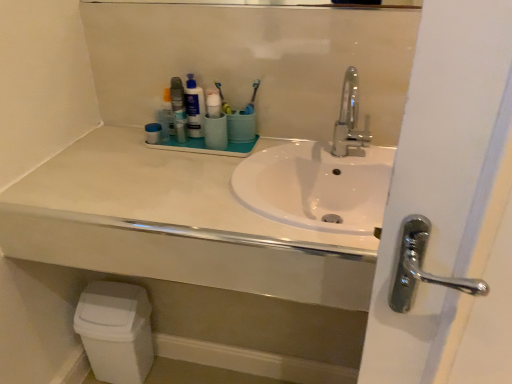
Question: From a real-world perspective, is white matte countertop at center physically located above or below white plastic toothbrush at center, placed as the 2th toothbrush when sorted from right to left?

Choices:
 (A) below
 (B) above

Answer: (A)

Question: Is white matte countertop at center inside or outside of white plastic toothbrush at center, placed as the 2th toothbrush when sorted from right to left?

Choices:
 (A) inside
 (B) outside

Answer: (B)

Question: Which of these objects is positioned farthest from the white glossy toothpaste tube at center, which is the 2th toiletry in left-to-right order?

Choices:
 (A) blue glossy lotion at center
 (B) polished chrome faucet at center
 (C) white matte countertop at center
 (D) blue plastic toothbrush at center, the 2th toothbrush viewed from the left
 (E) matte blue cup at center, which is the 1th toiletry from right to left

Answer: (C)

Question: Estimate the real-world distances between objects in this image. Which object is closer to the blue glossy lotion at center?

Choices:
 (A) white plastic toothbrush at center, placed as the 2th toothbrush when sorted from right to left
 (B) blue plastic toothbrush at center, the 2th toothbrush viewed from the left
 (C) white glossy toothpaste tube at center, the 2th toiletry positioned from the right
 (D) matte plastic container at upper center, which is counted as the 3th toiletry, starting from the right
 (E) matte blue cup at center, which is the 1th toiletry from right to left

Answer: (E)